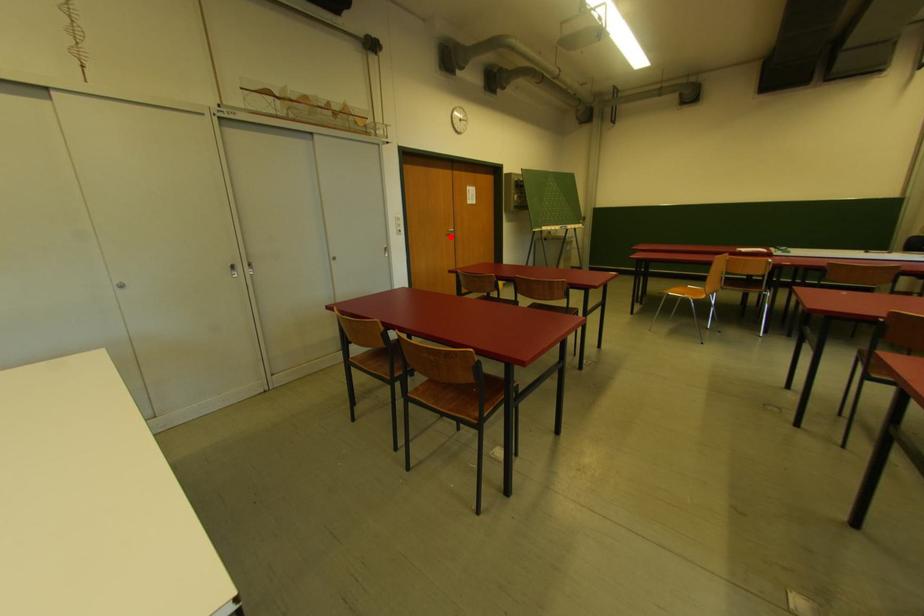
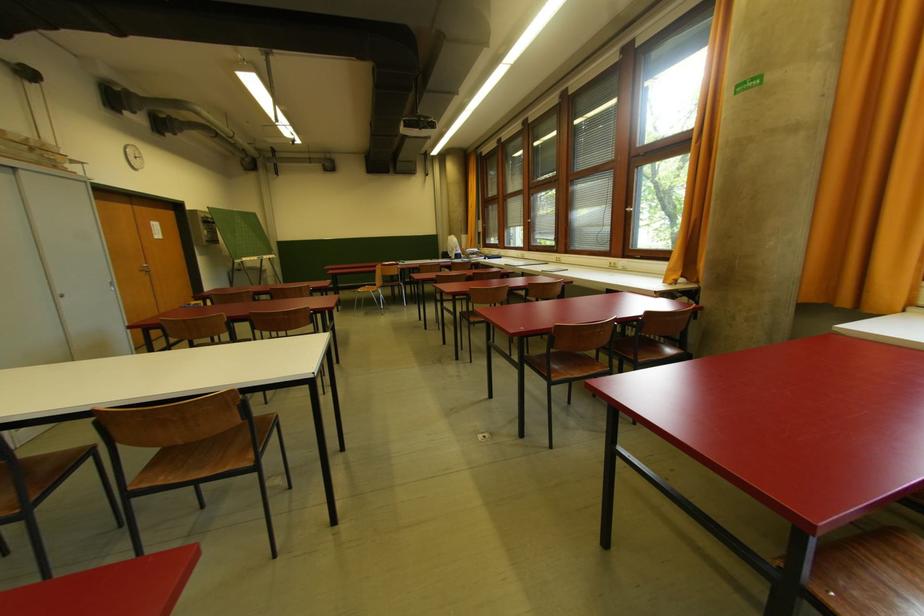
Where in the second image is the point corresponding to the highlighted location from the first image?

(144, 273)